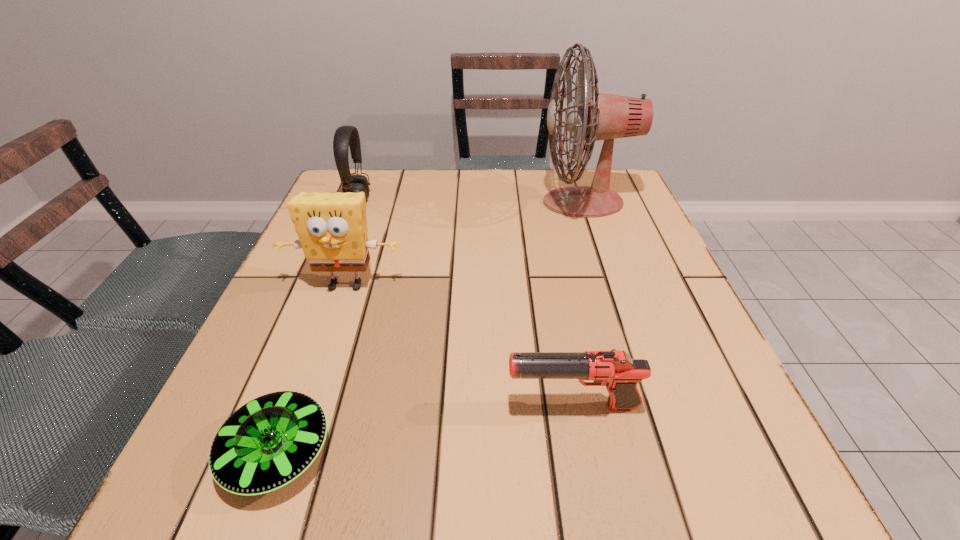
Locate an element on the screen. This screenshot has height=540, width=960. free space between the headset and the shortest object is located at coordinates (318, 326).

I want to click on the second closest object to the headset, so click(594, 116).

This screenshot has width=960, height=540. I want to click on object that is the third closest to the gun, so click(x=594, y=116).

Find the location of a particular element. free location that satisfies the following two spatial constraints: 1. on the front-facing side of the headset; 2. on the right side of the shortest object is located at coordinates (258, 453).

Locate an element on the screen. Image resolution: width=960 pixels, height=540 pixels. vacant area that satisfies the following two spatial constraints: 1. on the front-facing side of the headset; 2. on the right side of the shortest object is located at coordinates (258, 453).

In order to click on vacant position in the image that satisfies the following two spatial constraints: 1. in front of the tallest object to direct airflow; 2. on the face of the sponge in this screenshot , I will do `click(610, 285)`.

At what (x,y) coordinates should I click in order to perform the action: click on free space that satisfies the following two spatial constraints: 1. in front of the fan to direct airflow; 2. on the face of the third farthest object. Please return your answer as a coordinate pair (x, y). Looking at the image, I should click on (610, 285).

Where is `vacant position in the image that satisfies the following two spatial constraints: 1. in front of the tallest object to direct airflow; 2. on the face of the third nearest object`? vacant position in the image that satisfies the following two spatial constraints: 1. in front of the tallest object to direct airflow; 2. on the face of the third nearest object is located at coordinates (610, 285).

The image size is (960, 540). I want to click on vacant position in the image that satisfies the following two spatial constraints: 1. in front of the fan to direct airflow; 2. on the face of the sponge, so click(610, 285).

This screenshot has width=960, height=540. I want to click on vacant area in the image that satisfies the following two spatial constraints: 1. at the aiming end of the fourth tallest object; 2. on the front side of the saucer, so click(581, 453).